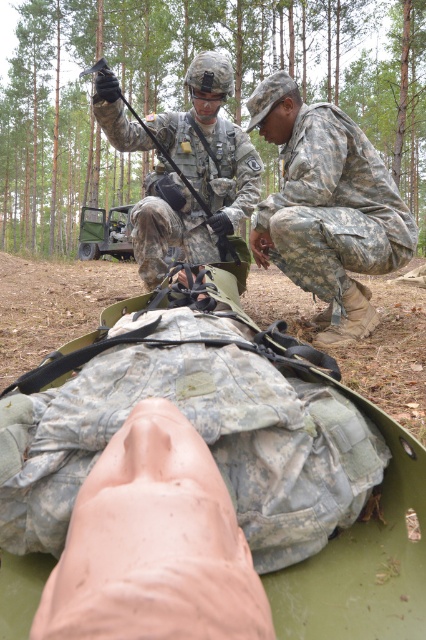
Is point (195, 129) farther from camera compared to point (91, 253)?

No.

Between camouflage uniform at upper center and camouflage fabric vehicle at center, which one appears on the right side from the viewer's perspective?

Positioned to the right is camouflage uniform at upper center.

Between point (104, 104) and point (103, 230), which one is positioned in front?

Positioned in front is point (104, 104).

Locate an element on the screen. camouflage uniform at upper center is located at coordinates (195, 176).

From the picture: Can you confirm if camouflage fabric uniform at lower right is shorter than camouflage uniform at upper center?

No, camouflage fabric uniform at lower right is not shorter than camouflage uniform at upper center.

Find the location of a particular element. This screenshot has height=640, width=426. camouflage fabric uniform at lower right is located at coordinates (327, 205).

This screenshot has width=426, height=640. What are the coordinates of `camouflage fabric uniform at lower right` in the screenshot? It's located at (327, 205).

Does camouflage fabric uniform at lower right have a greater height compared to camouflage fabric vehicle at center?

Yes.

I want to click on camouflage fabric uniform at lower right, so click(327, 205).